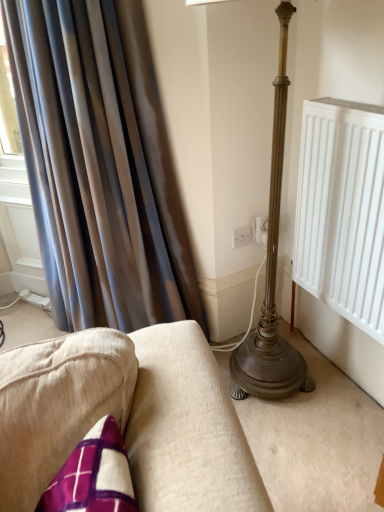
Question: Considering the relative positions of white plastic electric outlet at center, which is the first electric outlet in left-to-right order, and silky brown curtain at left in the image provided, is white plastic electric outlet at center, which is the first electric outlet in left-to-right order, to the left or to the right of silky brown curtain at left?

Choices:
 (A) left
 (B) right

Answer: (B)

Question: Does point (236, 233) appear closer or farther from the camera than point (135, 182)?

Choices:
 (A) farther
 (B) closer

Answer: (A)

Question: Which object is the closest to the silky brown curtain at left?

Choices:
 (A) white plastic electric outlet at center, which is counted as the second electric outlet, starting from the right
 (B) white plastic socket at center, which is the 1th electric outlet from right to left

Answer: (A)

Question: Which is farther from the white plastic electric outlet at center, which is the first electric outlet in left-to-right order?

Choices:
 (A) white plastic socket at center, which is the 1th electric outlet from right to left
 (B) silky brown curtain at left

Answer: (B)